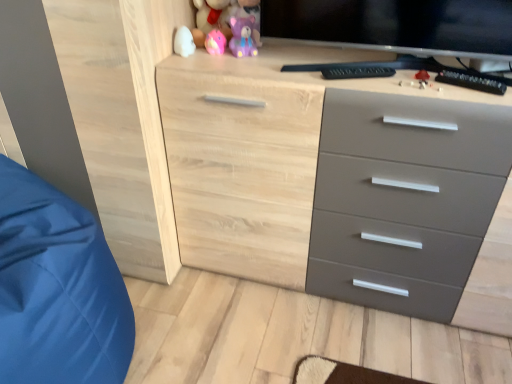
Identify the location of vacant area that lies in front of white glossy egg at upper left, positioned as the 4th toy in top-to-bottom order. The height and width of the screenshot is (384, 512). (191, 62).